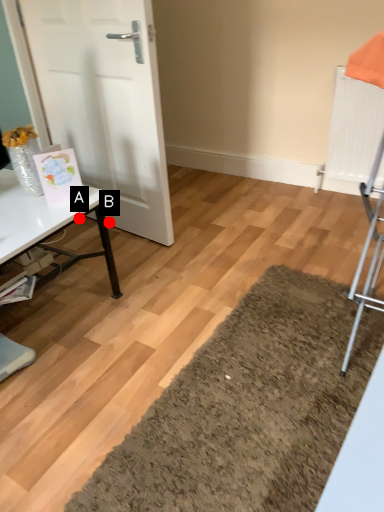
Question: Two points are circled on the image, labeled by A and B beside each circle. Which point is farther from the camera taking this photo?

Choices:
 (A) A is further
 (B) B is further

Answer: (B)